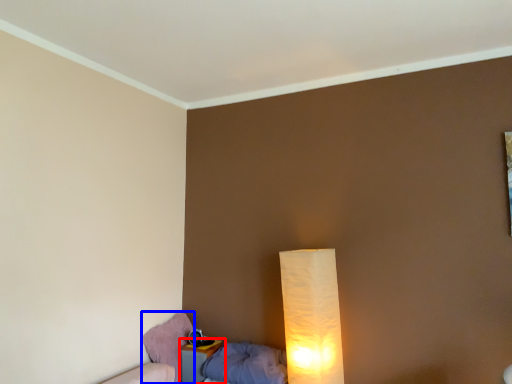
Question: Which of the following is the closest to the observer, nightstand (highlighted by a red box) or swivel chair (highlighted by a blue box)?

Choices:
 (A) nightstand
 (B) swivel chair

Answer: (A)